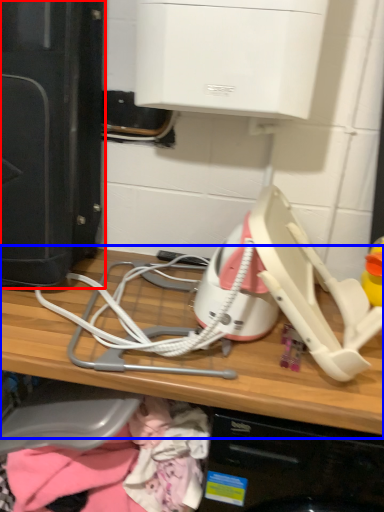
Question: Which object is closer to the camera taking this photo, home appliance (highlighted by a red box) or computer (highlighted by a blue box)?

Choices:
 (A) home appliance
 (B) computer

Answer: (B)